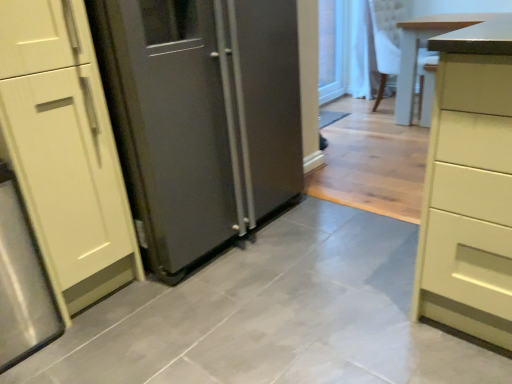
Question: Considering the positions of satin silver refrigerator at center and transparent glass door at upper right in the image, is satin silver refrigerator at center wider or thinner than transparent glass door at upper right?

Choices:
 (A) thin
 (B) wide

Answer: (B)

Question: Considering the positions of satin silver refrigerator at center and transparent glass door at upper right in the image, is satin silver refrigerator at center bigger or smaller than transparent glass door at upper right?

Choices:
 (A) big
 (B) small

Answer: (A)

Question: Which is farther from the light wood table at right?

Choices:
 (A) satin silver refrigerator at center
 (B) transparent glass door at upper right

Answer: (A)

Question: Considering the real-world distances, which object is farthest from the light wood table at right?

Choices:
 (A) satin silver refrigerator at center
 (B) transparent glass door at upper right

Answer: (A)